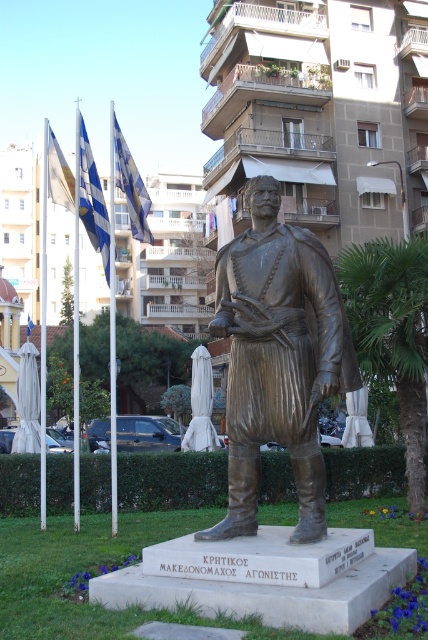
Question: Which is farther from the green leafy palm tree at center?

Choices:
 (A) blue fabric flag at left
 (B) blue-white striped flag at upper left
 (C) blue and white striped flag at left
 (D) bronze statue at center

Answer: (A)

Question: Does bronze statue at center have a greater width compared to blue fabric flag at left?

Choices:
 (A) no
 (B) yes

Answer: (A)

Question: Is the position of green leafy palm tree at center more distant than that of blue fabric flag at upper left?

Choices:
 (A) yes
 (B) no

Answer: (B)

Question: Can you confirm if blue-white striped flag at upper left is positioned to the left of blue fabric flag at left?

Choices:
 (A) yes
 (B) no

Answer: (B)

Question: Which point is farther to the camera?

Choices:
 (A) blue fabric flag at upper left
 (B) green leafy palm tree at center

Answer: (A)

Question: Which object is farther from the camera taking this photo?

Choices:
 (A) blue and white striped flag at left
 (B) green leafy palm tree at center

Answer: (A)